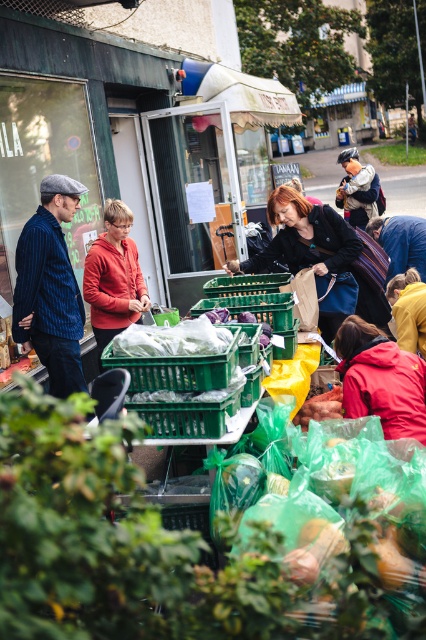
Can you confirm if red matte jacket at lower right is wider than smooth brown potato at center?

Correct, the width of red matte jacket at lower right exceeds that of smooth brown potato at center.

Can you confirm if red matte jacket at lower right is positioned to the left of smooth brown potato at center?

In fact, red matte jacket at lower right is to the right of smooth brown potato at center.

This screenshot has width=426, height=640. What do you see at coordinates (380, 380) in the screenshot?
I see `red matte jacket at lower right` at bounding box center [380, 380].

What are the coordinates of `red matte jacket at lower right` in the screenshot? It's located at (380, 380).

Is orange fleece jacket at center positioned at the back of yellow matte jacket at lower right?

That is True.

Is orange fleece jacket at center smaller than yellow matte jacket at lower right?

No.

The image size is (426, 640). In order to click on orange fleece jacket at center in this screenshot , I will do `click(114, 276)`.

In the scene shown: Measure the distance between red matte jacket at lower right and camera.

red matte jacket at lower right is 3.44 meters from camera.

Who is higher up, red matte jacket at lower right or wooden table at center?

wooden table at center is above.

Which is in front, point (342, 372) or point (406, 221)?

Positioned in front is point (342, 372).

At what (x,y) coordinates should I click in order to perform the action: click on red matte jacket at lower right. Please return your answer as a coordinate pair (x, y). Looking at the image, I should click on (380, 380).